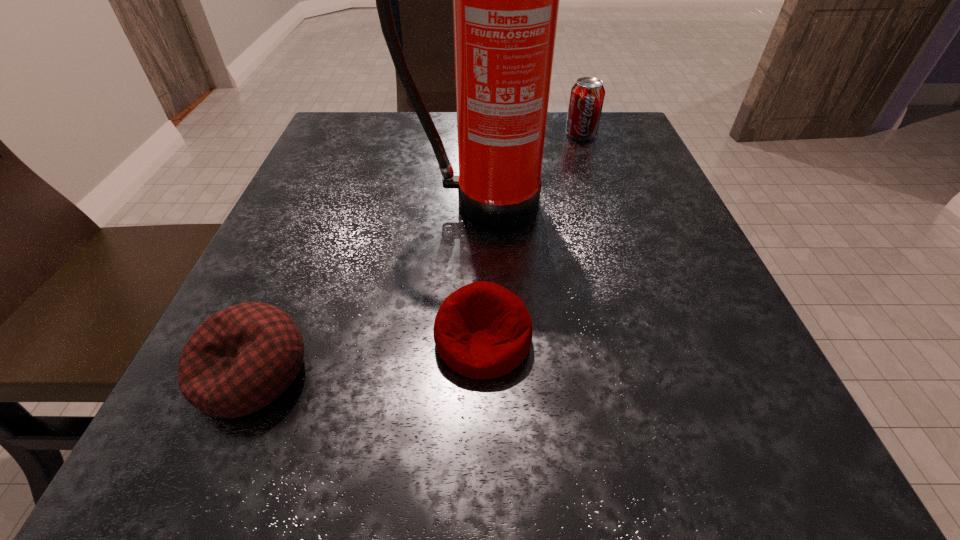
Find the location of a particular element. the tallest object is located at coordinates (506, 0).

Locate an element on the screen. This screenshot has width=960, height=540. the second farthest object is located at coordinates (506, 0).

Identify the location of the farthest object. Image resolution: width=960 pixels, height=540 pixels. (587, 95).

The height and width of the screenshot is (540, 960). I want to click on the rightmost object, so click(x=587, y=95).

You are a GUI agent. You are given a task and a screenshot of the screen. Output one action in this format:
    pyautogui.click(x=<x>, y=<y>)
    Task: Click on the left beanbag
    
    Given the screenshot: What is the action you would take?
    pyautogui.click(x=240, y=359)

Find the location of `the right beanbag`. the right beanbag is located at coordinates (482, 330).

Find the location of a particular element. This screenshot has width=960, height=540. vacant region located at the nozzle of the third nearest object is located at coordinates (479, 248).

What are the coordinates of `vacant area situated on the left of the farthest object` in the screenshot? It's located at (468, 134).

This screenshot has height=540, width=960. Identify the location of free space located 0.330m on the right of the leftmost object. (573, 373).

The image size is (960, 540). What are the coordinates of `vacant region located on the seat area of the right beanbag` in the screenshot? It's located at (484, 503).